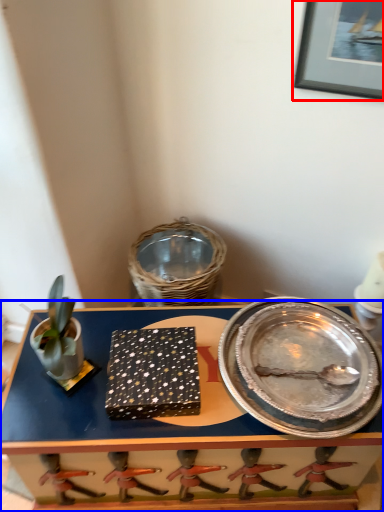
Question: Among these objects, which one is nearest to the camera, picture frame (highlighted by a red box) or table (highlighted by a blue box)?

Choices:
 (A) picture frame
 (B) table

Answer: (A)